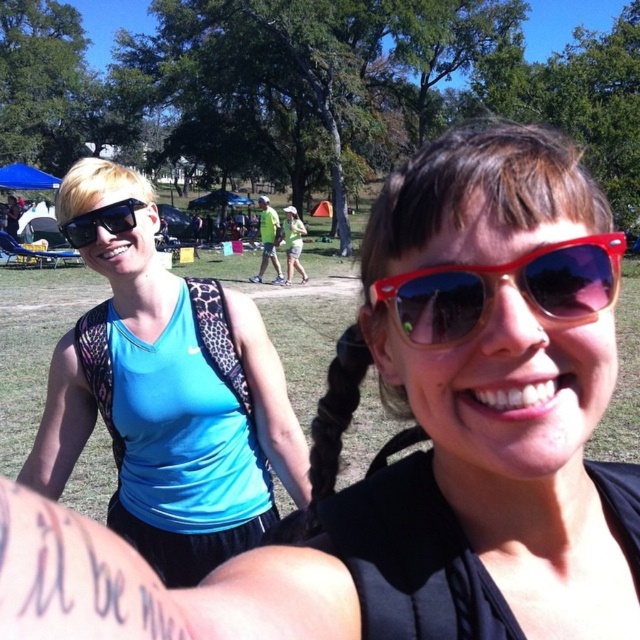
You are standing at the center of the park and see the point marked at coordinates (168, 396). What object is located at that point?

The blue leopard print tank top at left is located at point (168, 396).

You are a photographer trying to capture a closeup of the red plastic sunglasses at center and the matte black sunglasses at left. Which pair of sunglasses should you focus on first if you want to start with the one closer to the camera?

The red plastic sunglasses at center is located below matte black sunglasses at left, so the matte black sunglasses at left is closer to the camera. You should focus on the matte black sunglasses at left first.